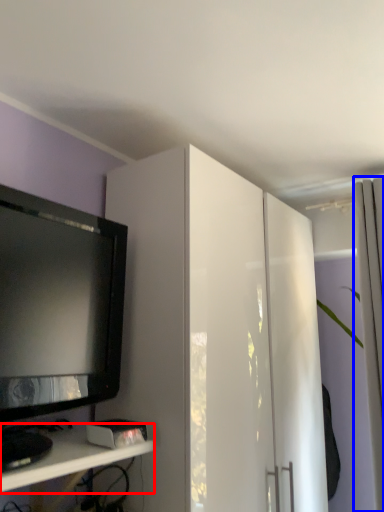
Question: Which of the following is the farthest to the observer, shelf (highlighted by a red box) or curtain (highlighted by a blue box)?

Choices:
 (A) shelf
 (B) curtain

Answer: (B)